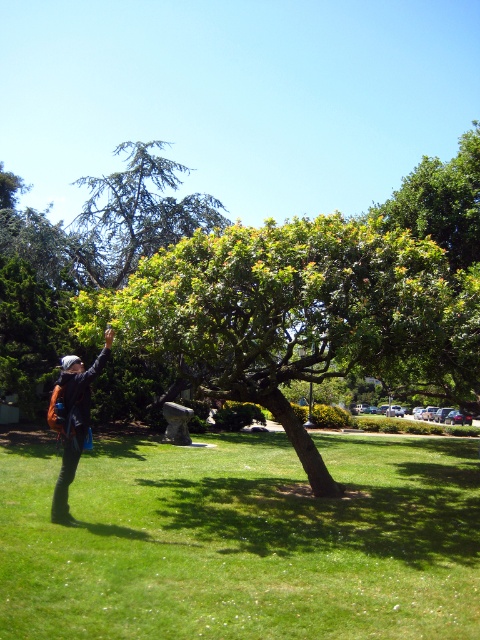
You are a hiker who wants to place your dark blue denim jacket at left on the green grass at lower left. Given the size of the grass area, will the jacket fit entirely without overlapping the edges?

The green grass at lower left has a larger size compared to dark blue denim jacket at left, so the jacket will fit entirely without overlapping the edges.

You are planning to take a photo of the green leafy tree at center and the dark blue denim jacket at left. Which object should you focus on first if you want to capture both in the same frame without moving the camera?

The green leafy tree at center might be wider than dark blue denim jacket at left, so you should focus on the green leafy tree at center first to ensure it fits within the frame.

You are a hiker who wants to take a photo of the tree. You have to decide whether to stand on the green grass at lower left or the dark blue denim jacket at left. Which surface is more suitable for a stable footing?

The green grass at lower left is below the dark blue denim jacket at left, so standing on the green grass at lower left would provide a more stable footing since it is a solid ground surface, whereas the dark blue denim jacket at left is likely part of clothing and not a stable base.